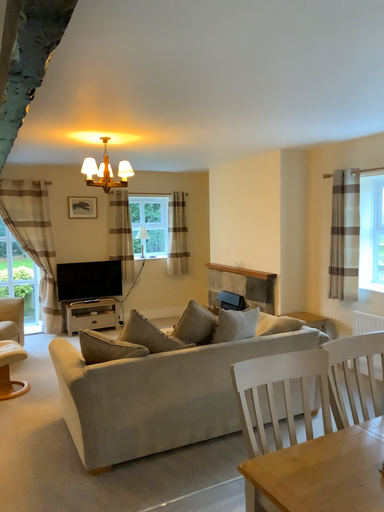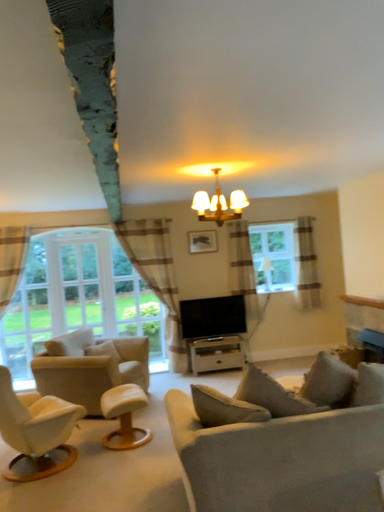
Question: How did the camera likely rotate when shooting the video?

Choices:
 (A) rotated left
 (B) rotated right

Answer: (A)